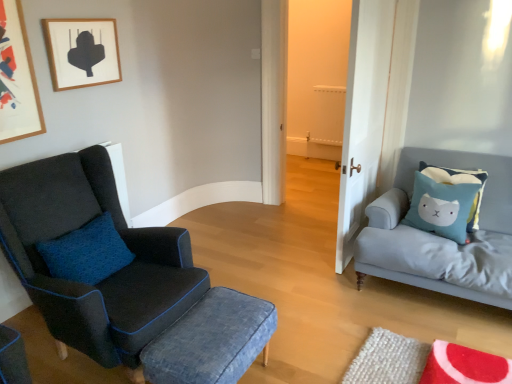
This screenshot has height=384, width=512. In order to click on vacant area to the left of light gray fabric studio couch at right in this screenshot , I will do `click(303, 286)`.